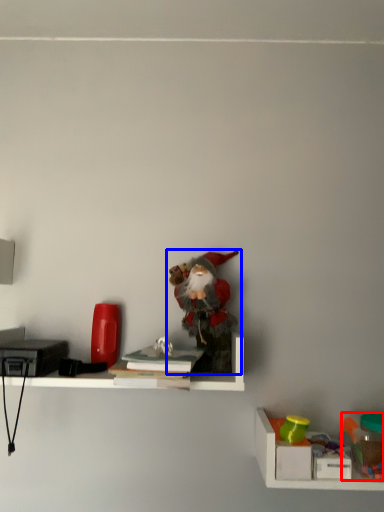
Question: Which point is further to the camera, toy (highlighted by a red box) or toy (highlighted by a blue box)?

Choices:
 (A) toy
 (B) toy

Answer: (B)